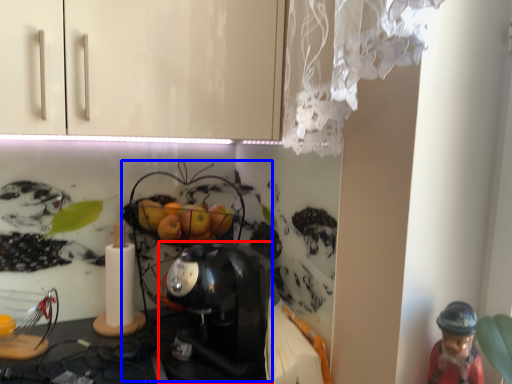
Question: Which object appears farthest to the camera in this image, coffee maker (highlighted by a red box) or toy (highlighted by a blue box)?

Choices:
 (A) coffee maker
 (B) toy

Answer: (B)